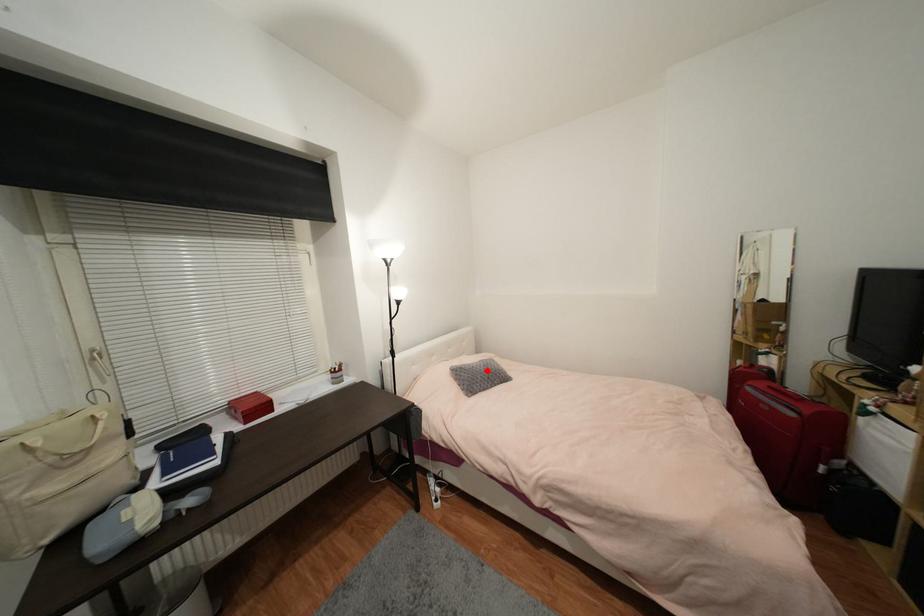
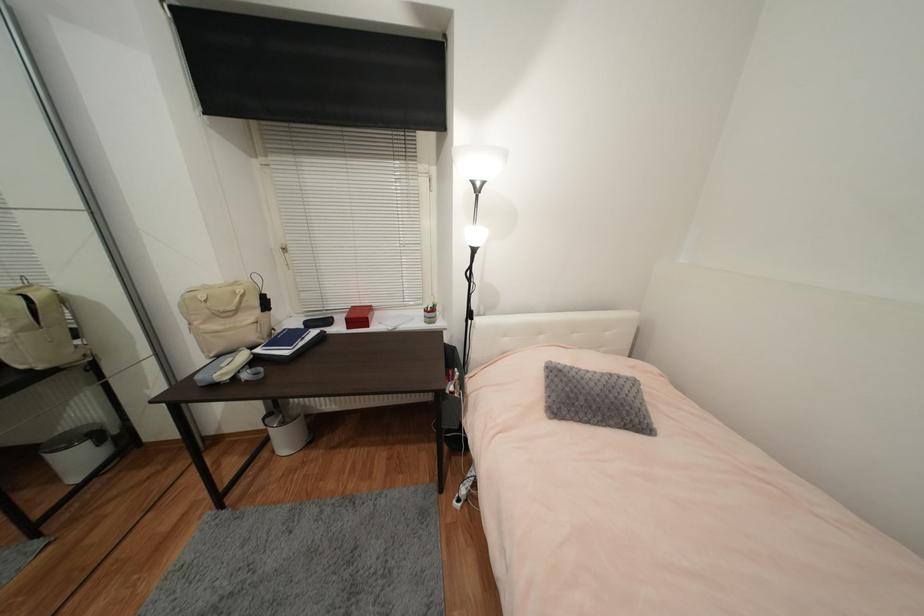
Question: A red point is marked in image1. In image2, is the corresponding 3D point closer to the camera or farther? Reply with the corresponding letter.

Choices:
 (A) The corresponding 3D point is closer.
 (B) The corresponding 3D point is farther.

Answer: (B)